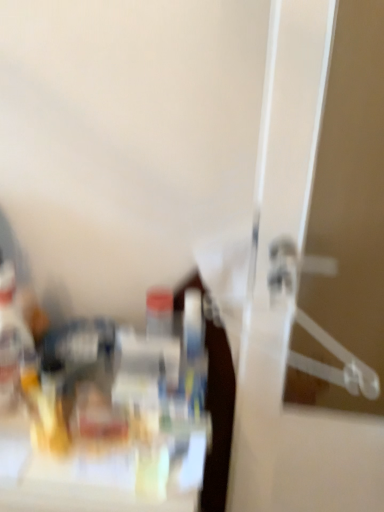
Question: Considering the relative sizes of clear plastic hanger at right and translucent plastic bottle at left in the image provided, is clear plastic hanger at right taller than translucent plastic bottle at left?

Choices:
 (A) no
 (B) yes

Answer: (A)

Question: Is translucent plastic bottle at left a part of clear plastic hanger at right?

Choices:
 (A) no
 (B) yes

Answer: (A)

Question: Would you say clear plastic hanger at right is outside translucent plastic bottle at left?

Choices:
 (A) yes
 (B) no

Answer: (A)

Question: Is clear plastic hanger at right looking in the opposite direction of translucent plastic bottle at left?

Choices:
 (A) yes
 (B) no

Answer: (B)

Question: Is clear plastic hanger at right thinner than translucent plastic bottle at left?

Choices:
 (A) yes
 (B) no

Answer: (A)

Question: Is clear plastic hanger at right closer to camera compared to translucent plastic bottle at left?

Choices:
 (A) no
 (B) yes

Answer: (B)

Question: From a real-world perspective, is translucent plastic bottle at left below clear plastic hanger at right?

Choices:
 (A) no
 (B) yes

Answer: (B)

Question: From a real-world perspective, is translucent plastic bottle at left on clear plastic hanger at right?

Choices:
 (A) yes
 (B) no

Answer: (B)

Question: Could you tell me if translucent plastic bottle at left is turned towards clear plastic hanger at right?

Choices:
 (A) no
 (B) yes

Answer: (A)

Question: Is translucent plastic bottle at left touching clear plastic hanger at right?

Choices:
 (A) no
 (B) yes

Answer: (A)

Question: Can you confirm if translucent plastic bottle at left is wider than clear plastic hanger at right?

Choices:
 (A) yes
 (B) no

Answer: (A)

Question: From the image's perspective, does translucent plastic bottle at left appear higher than clear plastic hanger at right?

Choices:
 (A) yes
 (B) no

Answer: (B)

Question: Considering the positions of translucent plastic bottle at left and clear plastic hanger at right in the image, is translucent plastic bottle at left bigger or smaller than clear plastic hanger at right?

Choices:
 (A) small
 (B) big

Answer: (A)